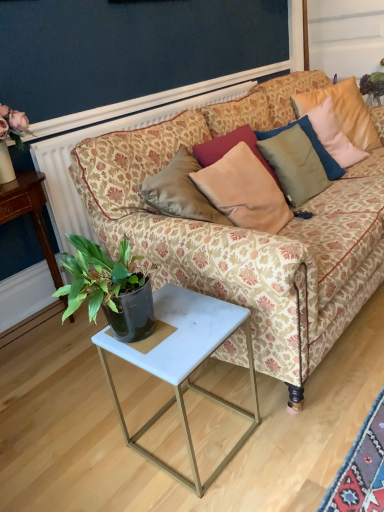
I want to click on free point to the left of white marble side table at lower center, so click(x=96, y=443).